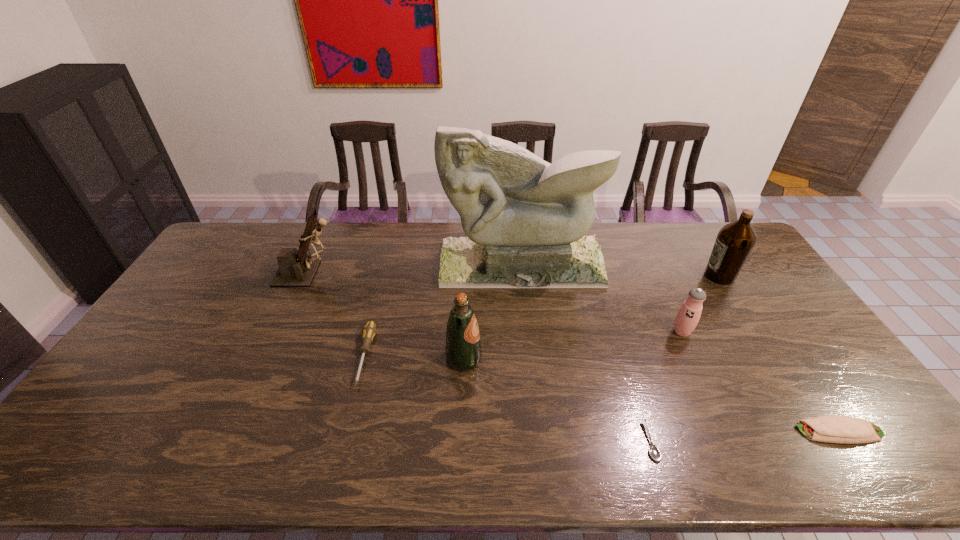
The height and width of the screenshot is (540, 960). Identify the location of free spot between the left olive oil and the shortest object. (557, 400).

Identify the location of empty space between the soupspoon and the screwdriver. (508, 399).

This screenshot has height=540, width=960. Find the location of `object that is the sixth closest one to the right olive oil`. object that is the sixth closest one to the right olive oil is located at coordinates (369, 331).

Identify the location of object that ranks as the fifth closest to the second shortest object. (463, 351).

You are a GUI agent. You are given a task and a screenshot of the screen. Output one action in this format:
    pyautogui.click(x=<x>, y=<y>)
    Task: Click on the free spot that satisfies the following two spatial constraints: 1. on the base of the sculpture; 2. on the right side of the sixth object from left to right
    The image size is (960, 540).
    Given the screenshot: What is the action you would take?
    pyautogui.click(x=528, y=332)

This screenshot has width=960, height=540. I want to click on vacant position in the image that satisfies the following two spatial constraints: 1. on the front-facing side of the figurine; 2. on the left side of the shortest object, so click(233, 441).

Where is `free location that satisfies the following two spatial constraints: 1. at the tip of the soupspoon; 2. on the right side of the screwdriver`? free location that satisfies the following two spatial constraints: 1. at the tip of the soupspoon; 2. on the right side of the screwdriver is located at coordinates (344, 441).